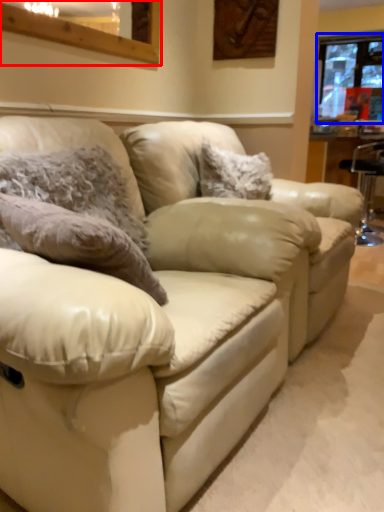
Question: Which object appears farthest to the camera in this image, window (highlighted by a red box) or window (highlighted by a blue box)?

Choices:
 (A) window
 (B) window

Answer: (B)